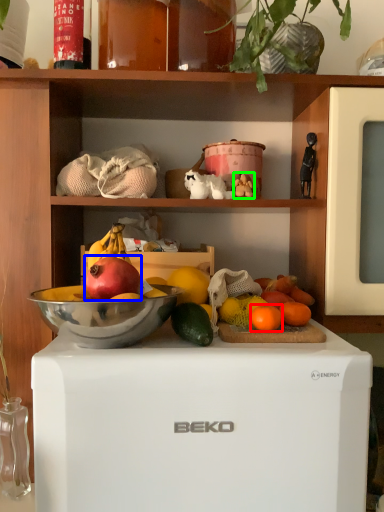
Question: Considering the real-world distances, which object is farthest from grapefruit (highlighted by a red box)? grapefruit (highlighted by a blue box) or toy (highlighted by a green box)?

Choices:
 (A) grapefruit
 (B) toy

Answer: (B)